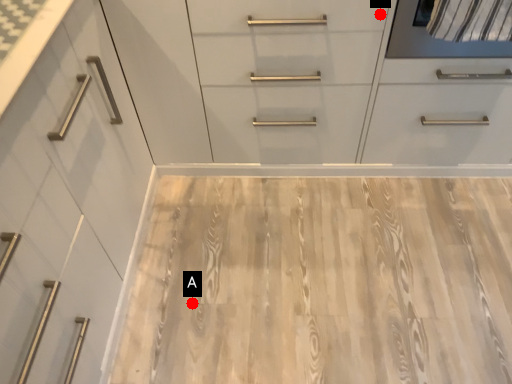
Question: Two points are circled on the image, labeled by A and B beside each circle. Which point is closer to the camera?

Choices:
 (A) A is closer
 (B) B is closer

Answer: (B)